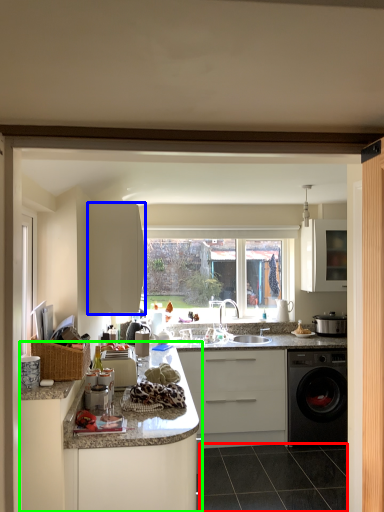
Question: Based on their relative distances, which object is nearer to tile (highlighted by a red box)? Choose from cabinetry (highlighted by a blue box) and cabinetry (highlighted by a green box).

Choices:
 (A) cabinetry
 (B) cabinetry

Answer: (B)